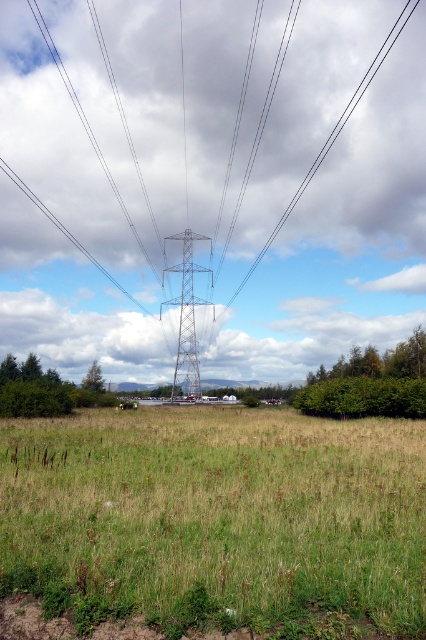
Who is positioned more to the right, green grassy field at center or metallic silver tower at center?

From the viewer's perspective, green grassy field at center appears more on the right side.

Measure the distance between green grassy field at center and metallic silver tower at center.

The distance of green grassy field at center from metallic silver tower at center is 51.91 meters.

You are a GUI agent. You are given a task and a screenshot of the screen. Output one action in this format:
    pyautogui.click(x=<x>, y=<y>)
    Task: Click on the green grassy field at center
    This screenshot has width=426, height=640.
    Given the screenshot: What is the action you would take?
    pyautogui.click(x=215, y=516)